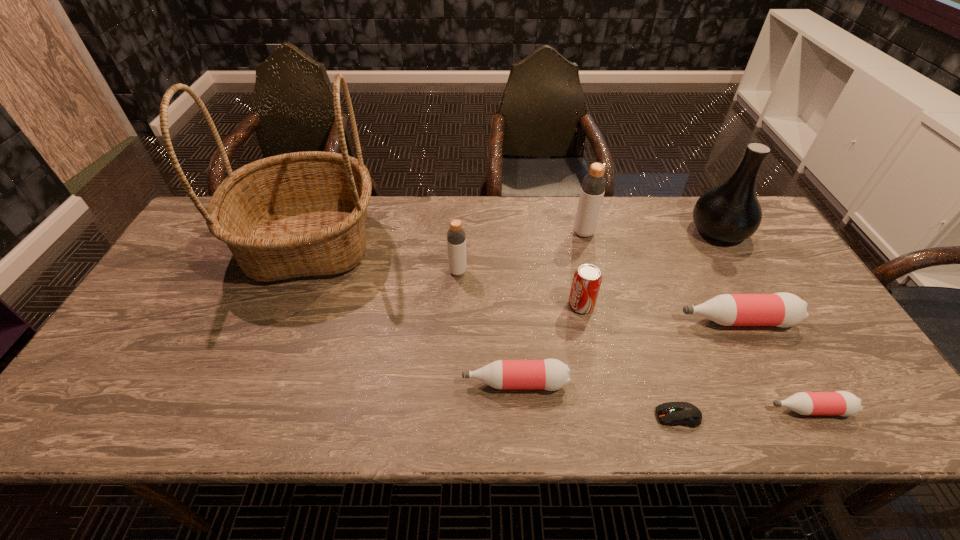
The height and width of the screenshot is (540, 960). In order to click on vacant point located between the farthest bottle and the shortest object in this screenshot , I will do `click(631, 325)`.

Locate an element on the screen. This screenshot has height=540, width=960. vacant area between the smaller gray bottle and the third bottle from right to left is located at coordinates (521, 252).

Locate an element on the screen. The image size is (960, 540). vacant space that is in between the seventh shortest object and the eighth shortest object is located at coordinates (651, 232).

At what (x,y) coordinates should I click in order to perform the action: click on vacant point located between the vase and the left gray bottle. Please return your answer as a coordinate pair (x, y). This screenshot has width=960, height=540. Looking at the image, I should click on (588, 251).

Identify the location of unoccupied position between the fifth tallest object and the second tallest object. The width and height of the screenshot is (960, 540). (650, 268).

The height and width of the screenshot is (540, 960). In order to click on vacant space that is in between the soda can and the fourth shortest object in this screenshot , I will do [x=659, y=313].

Identify which object is the second nearest to the fourth shortest object. Please provide its 2D coordinates. Your answer should be formatted as a tuple, i.e. [(x, y)], where the tuple contains the x and y coordinates of a point satisfying the conditions above.

[(674, 413)]

Locate which object is the seventh closest to the second tallest object. Please provide its 2D coordinates. Your answer should be formatted as a tuple, i.e. [(x, y)], where the tuple contains the x and y coordinates of a point satisfying the conditions above.

[(456, 237)]

Identify which bottle is the fourth closest to the leftmost pink bottle. Please provide its 2D coordinates. Your answer should be formatted as a tuple, i.e. [(x, y)], where the tuple contains the x and y coordinates of a point satisfying the conditions above.

[(593, 187)]

Select which bottle is the fifth closest to the fifth tallest object. Please provide its 2D coordinates. Your answer should be formatted as a tuple, i.e. [(x, y)], where the tuple contains the x and y coordinates of a point satisfying the conditions above.

[(843, 403)]